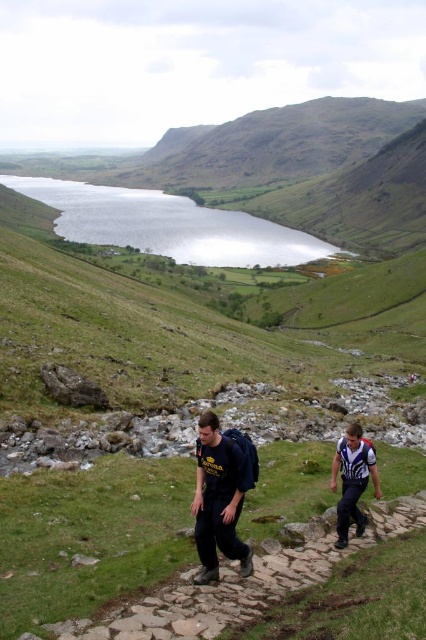
From the picture: You are trying to locate the dark blue jeans at center in the image. According to the coordinates provided, where exactly is it positioned?

The dark blue jeans at center is located at point coordinates of 0.773 on the x axis and 0.519 on the y axis.

Based on the scene description, where is the reflective glass water at upper center located in the image?

The reflective glass water at upper center is located at point (167,225).

In the scene shown: You are a photographer positioned at the starting point of the trail. You want to capture a photo that includes both the reflective glass water at upper center and the white fabric shirt at lower right. Which object should you adjust your focus on first to ensure both are in the frame?

You should focus on the reflective glass water at upper center first because it is closer to you than the white fabric shirt at lower right, so adjusting focus on it first will help ensure both are in the frame.